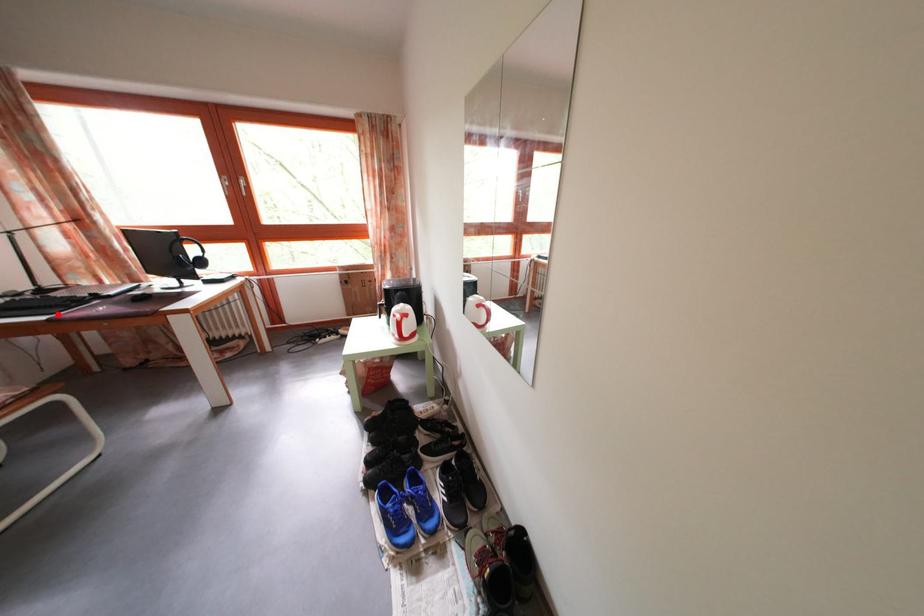
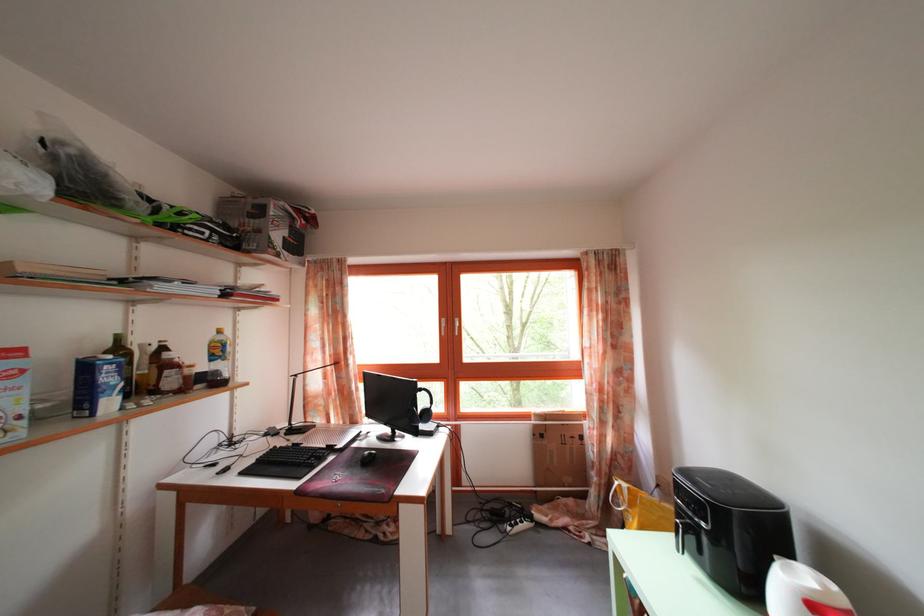
Find the pixel in the second image that matches the highlighted location in the first image.

(307, 472)